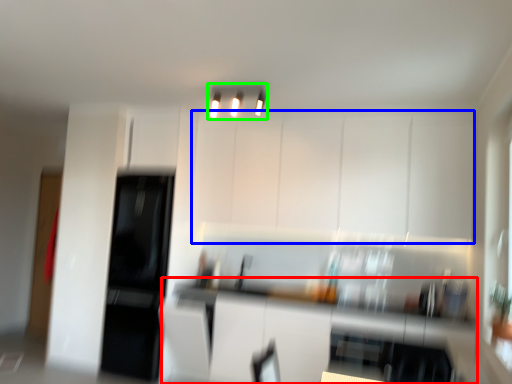
Question: Which is nearer to the counter top (highlighted by a red box)? cabinetry (highlighted by a blue box) or light fixture (highlighted by a green box).

Choices:
 (A) cabinetry
 (B) light fixture

Answer: (A)